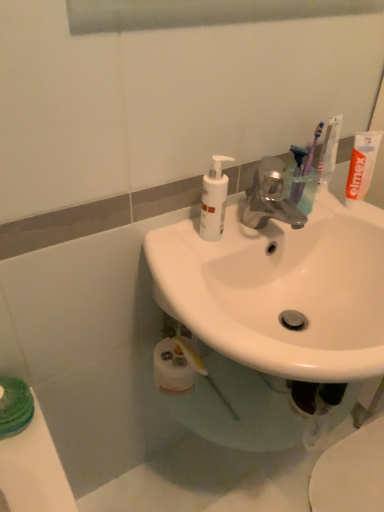
Find the location of `unoccupied region to the right of translucent plastic toothbrush at upper right, positioned as the third toothbrush in right-to-left order`. unoccupied region to the right of translucent plastic toothbrush at upper right, positioned as the third toothbrush in right-to-left order is located at coordinates (335, 207).